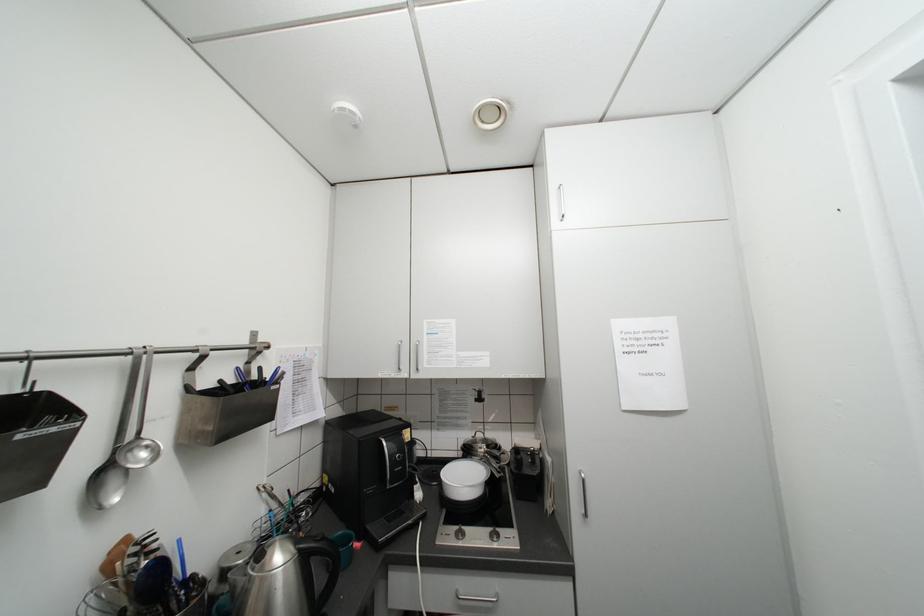
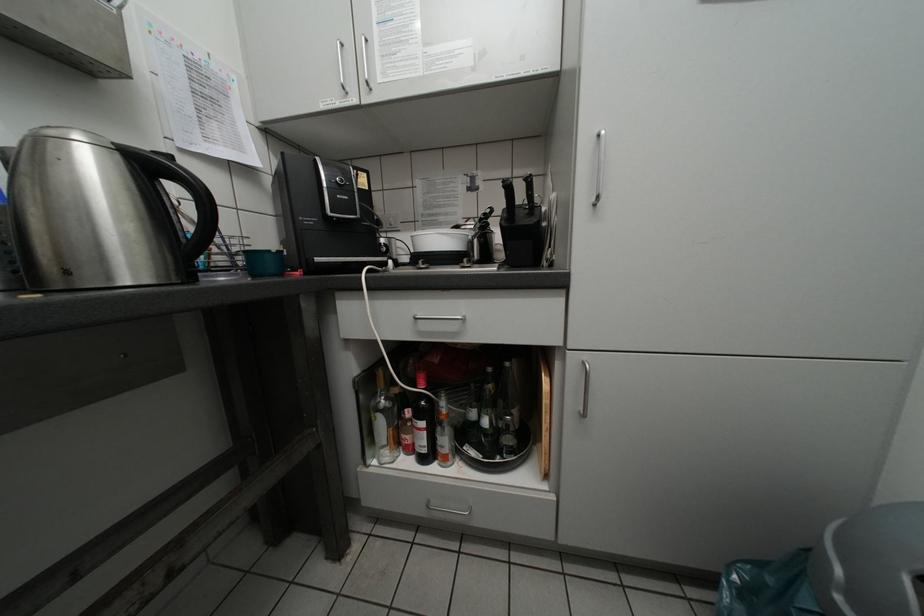
Question: How did the camera likely rotate?

Choices:
 (A) Left
 (B) Right
 (C) Up
 (D) Down

Answer: (D)